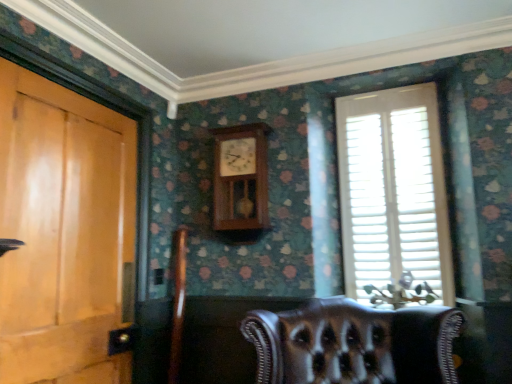
Question: Is white wood blinds at right closer to the viewer compared to wooden clock at center?

Choices:
 (A) no
 (B) yes

Answer: (B)

Question: Does white wood blinds at right have a greater height compared to wooden clock at center?

Choices:
 (A) yes
 (B) no

Answer: (A)

Question: From the image's perspective, is white wood blinds at right over wooden clock at center?

Choices:
 (A) yes
 (B) no

Answer: (B)

Question: Is white wood blinds at right to the right of wooden clock at center from the viewer's perspective?

Choices:
 (A) no
 (B) yes

Answer: (B)

Question: Can you confirm if white wood blinds at right is bigger than wooden clock at center?

Choices:
 (A) yes
 (B) no

Answer: (A)

Question: Is the depth of white wood blinds at right greater than that of wooden clock at center?

Choices:
 (A) yes
 (B) no

Answer: (B)

Question: Could white wood blinds at right be considered to be inside leather chair at lower center?

Choices:
 (A) no
 (B) yes

Answer: (A)

Question: Can you confirm if leather chair at lower center is positioned to the right of white wood blinds at right?

Choices:
 (A) no
 (B) yes

Answer: (A)

Question: Is leather chair at lower center next to white wood blinds at right?

Choices:
 (A) no
 (B) yes

Answer: (A)

Question: Is white wood blinds at right at the back of leather chair at lower center?

Choices:
 (A) yes
 (B) no

Answer: (B)

Question: Is the depth of leather chair at lower center greater than that of white wood blinds at right?

Choices:
 (A) yes
 (B) no

Answer: (B)

Question: Is leather chair at lower center positioned before white wood blinds at right?

Choices:
 (A) no
 (B) yes

Answer: (B)

Question: Is leather chair at lower center facing away from light brown wood door at left?

Choices:
 (A) no
 (B) yes

Answer: (A)